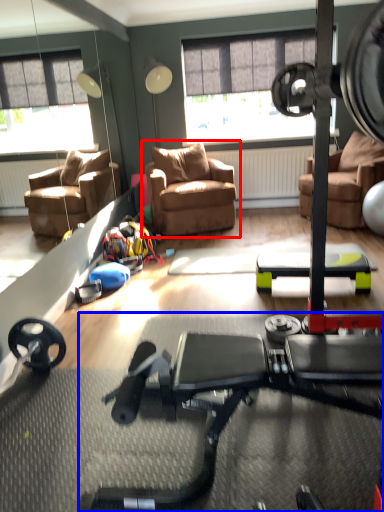
Question: Which object appears farthest to the camera in this image, chair (highlighted by a red box) or stationary bicycle (highlighted by a blue box)?

Choices:
 (A) chair
 (B) stationary bicycle

Answer: (A)